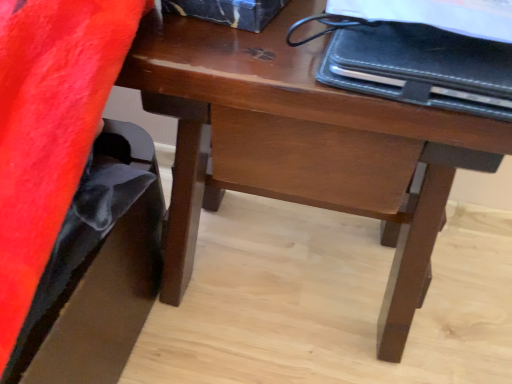
Find the location of a particular element. The image size is (512, 384). wooden desk at center is located at coordinates (300, 144).

Describe the element at coordinates (300, 144) in the screenshot. I see `wooden desk at center` at that location.

The image size is (512, 384). Describe the element at coordinates (422, 66) in the screenshot. I see `black leather notebook at upper right` at that location.

The height and width of the screenshot is (384, 512). I want to click on black leather notebook at upper right, so click(422, 66).

In order to face black leather notebook at upper right, should I rotate leftwards or rightwards?

It's best to rotate right around 24.189 degrees.

Find the location of `wooden desk at center`. wooden desk at center is located at coordinates (300, 144).

Which is more to the right, black leather notebook at upper right or wooden desk at center?

From the viewer's perspective, black leather notebook at upper right appears more on the right side.

Considering the relative positions of black leather notebook at upper right and wooden desk at center in the image provided, is black leather notebook at upper right behind wooden desk at center?

No, it is in front of wooden desk at center.

Does point (447, 39) come behind point (168, 24)?

No, it is not.

From the image's perspective, who appears lower, black leather notebook at upper right or wooden desk at center?

wooden desk at center is shown below in the image.

From a real-world perspective, which is physically below, black leather notebook at upper right or wooden desk at center?

wooden desk at center.

Between black leather notebook at upper right and wooden desk at center, which one has smaller width?

With smaller width is black leather notebook at upper right.

Can you confirm if black leather notebook at upper right is shorter than wooden desk at center?

Correct, black leather notebook at upper right is not as tall as wooden desk at center.

Considering the sizes of objects black leather notebook at upper right and wooden desk at center in the image provided, who is bigger, black leather notebook at upper right or wooden desk at center?

Bigger between the two is wooden desk at center.

Would you say black leather notebook at upper right is inside or outside wooden desk at center?

black leather notebook at upper right exists outside the volume of wooden desk at center.

Is black leather notebook at upper right not near wooden desk at center?

Actually, black leather notebook at upper right and wooden desk at center are a little close together.

From the picture: Is black leather notebook at upper right facing away from wooden desk at center?

No, black leather notebook at upper right is not facing away from wooden desk at center.

What's the angular difference between black leather notebook at upper right and wooden desk at center's facing directions?

black leather notebook at upper right and wooden desk at center are facing 2.32 degrees away from each other.

The image size is (512, 384). Find the location of `desk that is on the left side of black leather notebook at upper right`. desk that is on the left side of black leather notebook at upper right is located at coordinates pos(300,144).

Considering the positions of objects wooden desk at center and black leather notebook at upper right in the image provided, who is more to the right, wooden desk at center or black leather notebook at upper right?

black leather notebook at upper right.

Is the depth of wooden desk at center greater than that of black leather notebook at upper right?

Yes, it is behind black leather notebook at upper right.

Is point (302, 58) behind point (352, 81)?

Yes, it is.

From the image's perspective, which is above, wooden desk at center or black leather notebook at upper right?

black leather notebook at upper right.

From a real-world perspective, is wooden desk at center physically located above or below black leather notebook at upper right?

wooden desk at center is situated lower than black leather notebook at upper right in the real world.

In terms of width, does wooden desk at center look wider or thinner when compared to black leather notebook at upper right?

Considering their sizes, wooden desk at center looks broader than black leather notebook at upper right.

Is wooden desk at center taller or shorter than black leather notebook at upper right?

Considering their sizes, wooden desk at center has more height than black leather notebook at upper right.

Who is bigger, wooden desk at center or black leather notebook at upper right?

With larger size is wooden desk at center.

Is wooden desk at center inside the boundaries of black leather notebook at upper right, or outside?

wooden desk at center lies outside black leather notebook at upper right.

Are wooden desk at center and black leather notebook at upper right beside each other?

wooden desk at center and black leather notebook at upper right are clearly separated.

Does wooden desk at center turn towards black leather notebook at upper right?

No, wooden desk at center is not turned towards black leather notebook at upper right.

Where is `desk on the left of black leather notebook at upper right`? The height and width of the screenshot is (384, 512). desk on the left of black leather notebook at upper right is located at coordinates (300, 144).

Find the location of a particular element. desk behind the black leather notebook at upper right is located at coordinates (300, 144).

The width and height of the screenshot is (512, 384). In the image, there is a black leather notebook at upper right. In order to click on desk below it (from a real-world perspective) in this screenshot , I will do `click(300, 144)`.